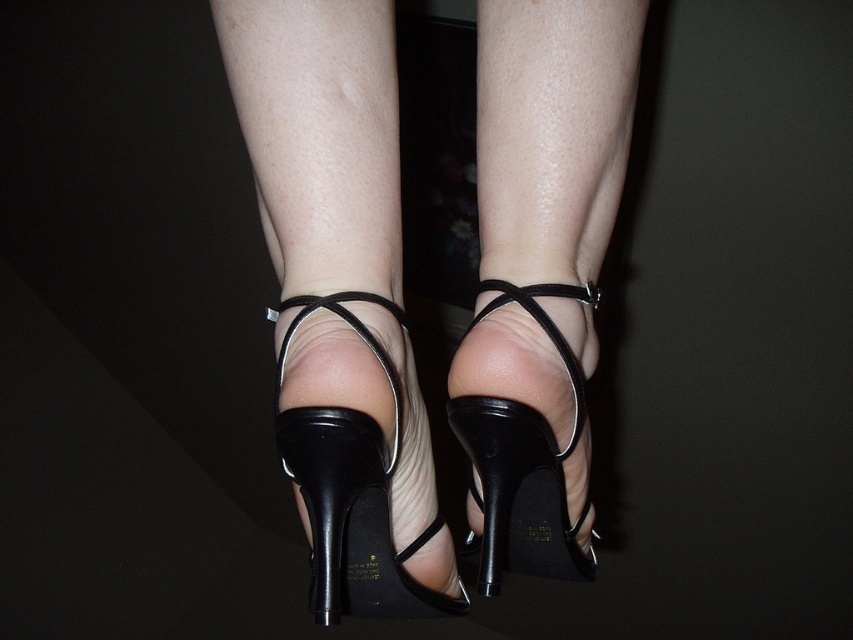
Where is the black leather heels at center located in the image?

The black leather heels at center is located at point (340,300).